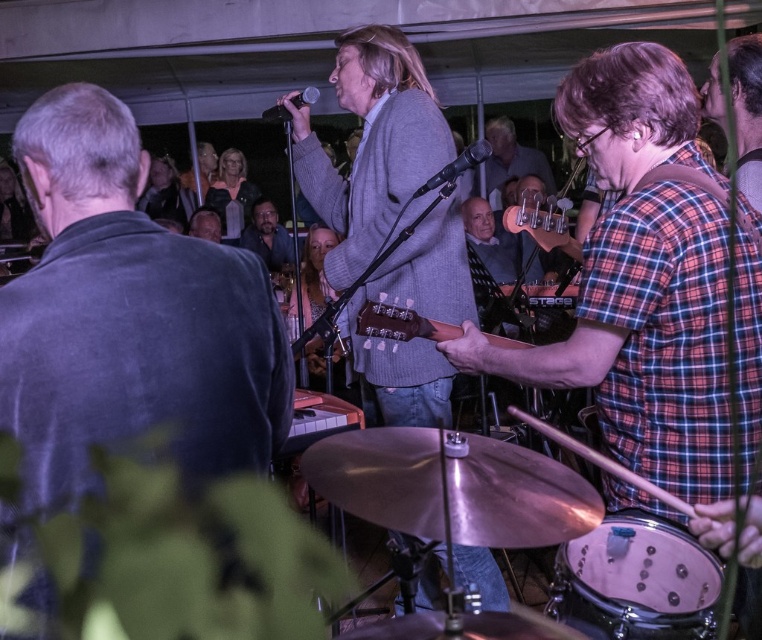
Can you confirm if light brown wooden guitar at center is positioned to the right of plaid fabric shirt at center?

No, light brown wooden guitar at center is not to the right of plaid fabric shirt at center.

Between light brown wooden guitar at center and plaid fabric shirt at center, which one appears on the left side from the viewer's perspective?

light brown wooden guitar at center is more to the left.

Looking at this image, measure the distance between point (x=452, y=324) and camera.

The distance of point (x=452, y=324) from camera is 2.07 meters.

Where is `light brown wooden guitar at center`? light brown wooden guitar at center is located at coordinates (402, 323).

Does velvet blue jacket at upper left have a larger size compared to white drumhead at lower right?

Yes, velvet blue jacket at upper left is bigger than white drumhead at lower right.

Identify the location of velvet blue jacket at upper left. The width and height of the screenshot is (762, 640). (127, 317).

Who is positioned more to the left, plaid fabric shirt at center or matte black guitar at center?

matte black guitar at center

Measure the distance between plaid fabric shirt at center and camera.

The distance of plaid fabric shirt at center from camera is 5.45 meters.

I want to click on plaid fabric shirt at center, so click(511, 157).